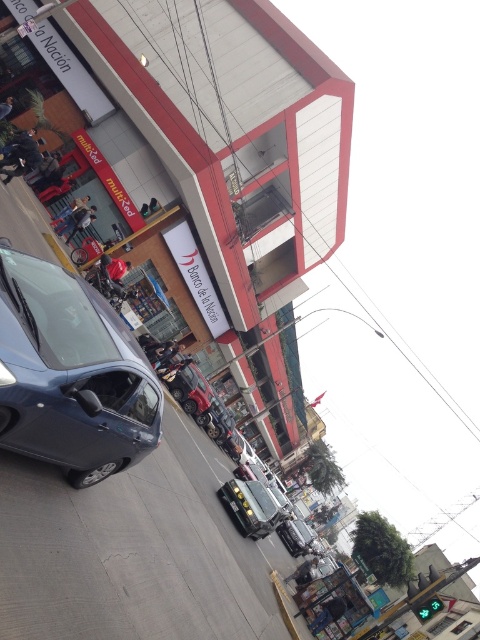
You are a pedestrian standing at the crosswalk and want to cross the street. There is a metallic gray car at left and a metallic silver car at center. Which car is closer to you?

The metallic gray car at left is closer to you because it is in front of the metallic silver car at center.

You are a delivery person who needs to park your 1.8 meters tall delivery cart between the metallic gray car at left and the metallic silver car at center. Is there enough vertical space for your cart to fit between them?

The metallic gray car at left is much taller than the metallic silver car at center. Since your delivery cart is only 1.8 meters tall, it should fit vertically between them as long as the lower space between the cars is sufficient. However, the exact vertical clearance depends on the height of the lower parts of both cars.